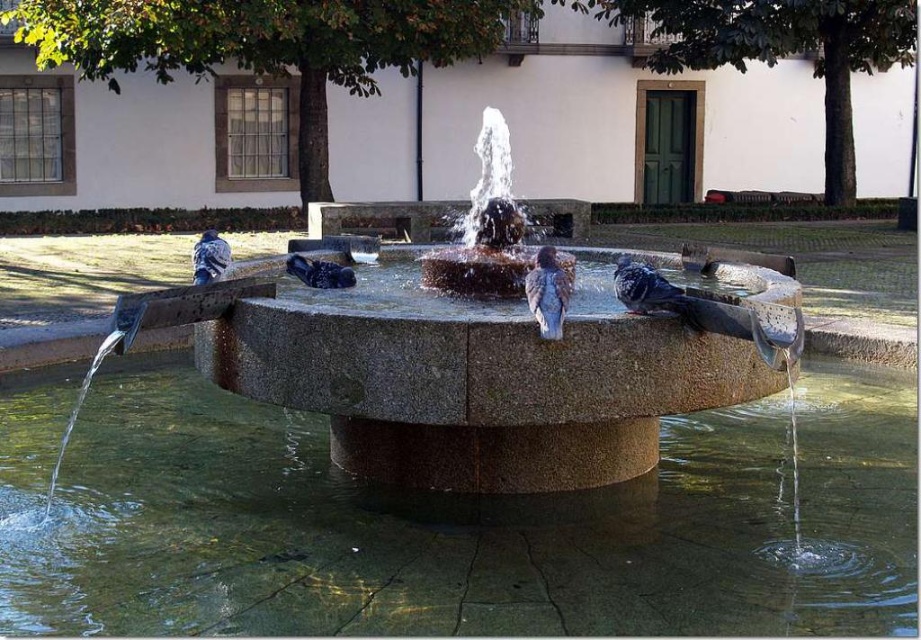
Question: Is clear water at fountain center thinner than matte black pigeon at center?

Choices:
 (A) no
 (B) yes

Answer: (A)

Question: In this image, where is granite fountain at center located relative to matte black pigeon at center?

Choices:
 (A) right
 (B) left

Answer: (A)

Question: Which object is farther from the camera taking this photo?

Choices:
 (A) gray matte pigeon at center
 (B) matte black pigeon at center
 (C) clear water at fountain center
 (D) granite fountain at center

Answer: (B)

Question: Can you confirm if granite fountain at center is positioned above blue-gray feathers at left?

Choices:
 (A) no
 (B) yes

Answer: (B)

Question: Estimate the real-world distances between objects in this image. Which object is closer to the blue-gray feathers at left?

Choices:
 (A) clear water at fountain center
 (B) brown speckled feathers at center

Answer: (B)

Question: Estimate the real-world distances between objects in this image. Which object is closer to the clear water at fountain center?

Choices:
 (A) blue-gray feathers at left
 (B) matte black pigeon at center
 (C) granite fountain at center

Answer: (B)